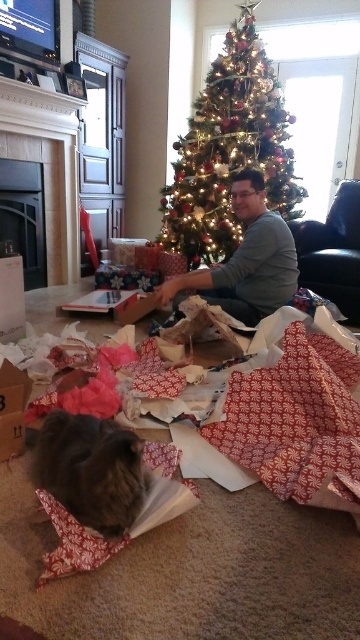
Question: Estimate the real-world distances between objects in this image. Which object is farther from the cardboard box at lower left?

Choices:
 (A) velvet dark blue couch at right
 (B) shiny gold christmas tree at center
 (C) gray cotton shirt at center

Answer: (B)

Question: Is gray cotton shirt at center below cardboard box at lower left?

Choices:
 (A) yes
 (B) no

Answer: (B)

Question: Is the position of shiny gold christmas tree at center more distant than that of fluffy gray cat at lower left?

Choices:
 (A) no
 (B) yes

Answer: (B)

Question: Which of the following is the closest to the observer?

Choices:
 (A) velvet dark blue couch at right
 (B) cardboard box at lower left

Answer: (B)

Question: Can you confirm if velvet dark blue couch at right is positioned to the right of cardboard box at lower left?

Choices:
 (A) no
 (B) yes

Answer: (B)

Question: Estimate the real-world distances between objects in this image. Which object is closer to the fluffy gray cat at lower left?

Choices:
 (A) shiny gold christmas tree at center
 (B) gray cotton shirt at center
 (C) cardboard box at lower left

Answer: (C)